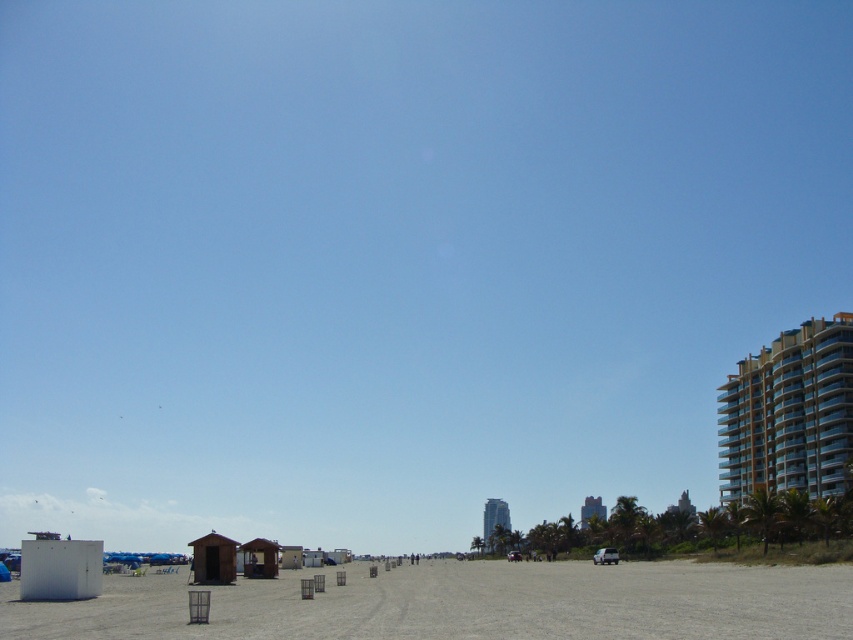
How much distance is there between metallic gold balcony at right and wooden cabin at lower center?

A distance of 92.38 meters exists between metallic gold balcony at right and wooden cabin at lower center.

Who is taller, metallic gold balcony at right or wooden cabin at lower center?

With more height is wooden cabin at lower center.

The height and width of the screenshot is (640, 853). What are the coordinates of `metallic gold balcony at right` in the screenshot? It's located at (788, 413).

Does white matte beach hut at lower left have a larger size compared to wooden cabin at lower center?

Yes, white matte beach hut at lower left is bigger than wooden cabin at lower center.

Is white matte beach hut at lower left to the left of wooden cabin at lower center from the viewer's perspective?

Indeed, white matte beach hut at lower left is positioned on the left side of wooden cabin at lower center.

Is point (59, 584) farther from camera compared to point (250, 561)?

That is False.

The image size is (853, 640). What are the coordinates of `white matte beach hut at lower left` in the screenshot? It's located at click(59, 568).

Is wooden cabin at lower left positioned at the back of wooden cabin at lower center?

That is False.

Does wooden cabin at lower left have a lesser height compared to wooden cabin at lower center?

No, wooden cabin at lower left is not shorter than wooden cabin at lower center.

This screenshot has width=853, height=640. I want to click on wooden cabin at lower left, so click(x=213, y=557).